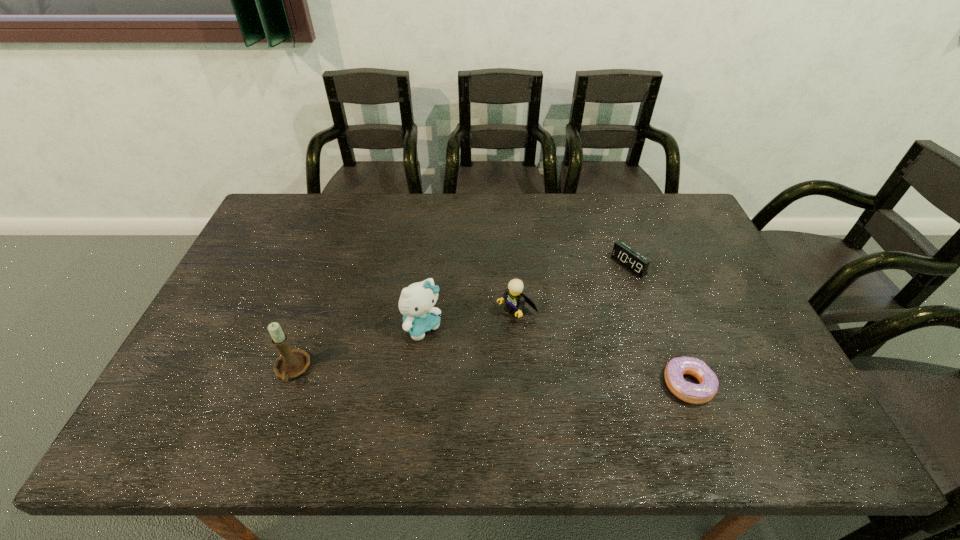
This screenshot has height=540, width=960. In order to click on free space at the near edge in this screenshot , I will do `click(434, 399)`.

Identify the location of free region at the left edge of the desktop. (293, 260).

Find the location of a particular element. Image resolution: width=960 pixels, height=540 pixels. vacant space at the right edge is located at coordinates (715, 299).

Where is `vacant space at the far left corner`? vacant space at the far left corner is located at coordinates (275, 206).

Locate an element on the screen. Image resolution: width=960 pixels, height=540 pixels. blank space at the near right corner of the desktop is located at coordinates (757, 404).

This screenshot has height=540, width=960. I want to click on vacant area that lies between the candle holder and the Lego, so click(405, 340).

Locate an element on the screen. Image resolution: width=960 pixels, height=540 pixels. vacant region between the candle holder and the shortest object is located at coordinates (490, 377).

This screenshot has height=540, width=960. I want to click on vacant area that lies between the doughnut and the second object from left to right, so click(555, 355).

This screenshot has width=960, height=540. Identify the location of vacant space that's between the fourth object from right to left and the doughnut. (555, 355).

Locate an element on the screen. The height and width of the screenshot is (540, 960). vacant space in between the fourth object from right to left and the doughnut is located at coordinates (555, 355).